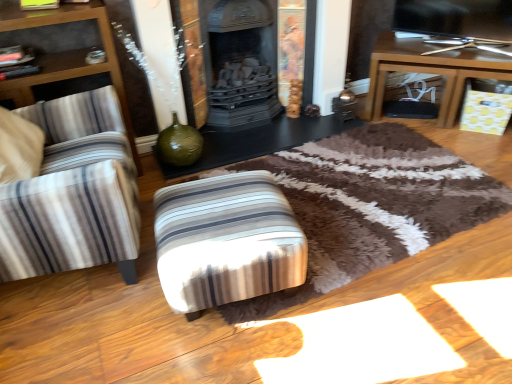
Where is `unoccupied area in front of brown wooden table at right, acting as the 1th table starting from the right`? Image resolution: width=512 pixels, height=384 pixels. unoccupied area in front of brown wooden table at right, acting as the 1th table starting from the right is located at coordinates [451, 162].